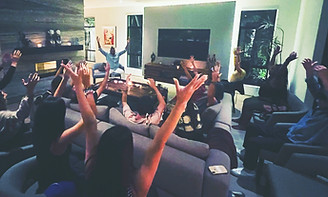
You are a GUI agent. You are given a task and a screenshot of the screen. Output one action in this format:
    pyautogui.click(x=<x>, y=<y>)
    Task: Click on the plant
    
    Given the screenshot: What is the action you would take?
    pyautogui.click(x=263, y=51)